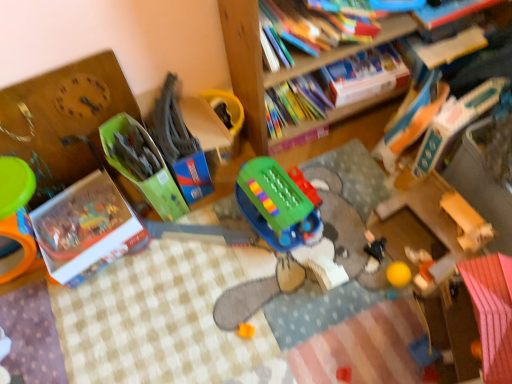
The image size is (512, 384). Identify the location of vacant space that is in between orange matte cube at center, positioned as the third toy in left-to-right order, and rubberized orange ball at lower right, which is the first toy in right-to-left order. (333, 304).